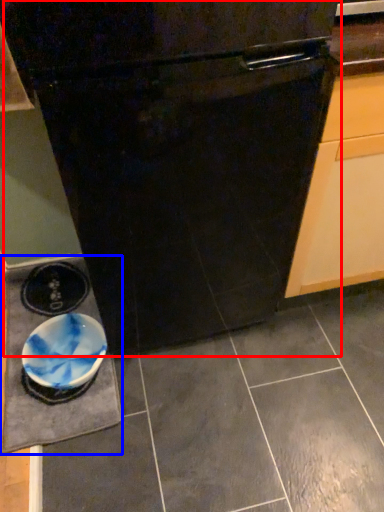
Question: Which object is closer to the camera taking this photo, oven (highlighted by a red box) or slate (highlighted by a blue box)?

Choices:
 (A) oven
 (B) slate

Answer: (A)